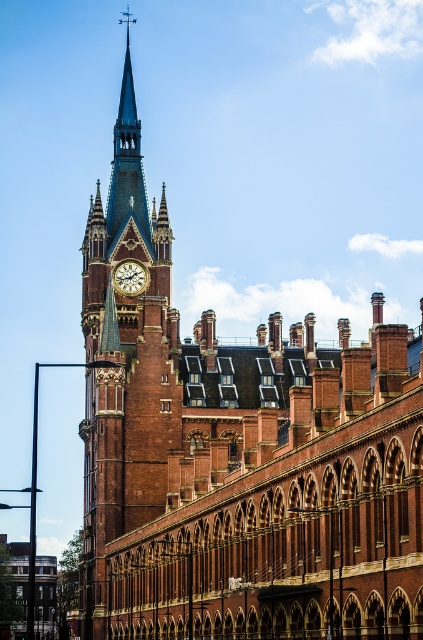
Consider the image. Based on the scene description, which object is positioned to the left of the other between the polished copper spire at upper left and the gold metallic clock at upper center?

The polished copper spire at upper left is to the left of the gold metallic clock at upper center.

You are an architect designing a new building and want to place a decorative element at point (x=126, y=161). What object from the scene is already located there?

The polished copper spire at upper left is located at point (x=126, y=161).

You are an architect inspecting the building from the ground. You notice the polished copper spire at upper left and the gold metallic clock at upper center. Which of these two objects appears bigger in size?

The polished copper spire at upper left is larger in size than the gold metallic clock at upper center, so it appears bigger in size.